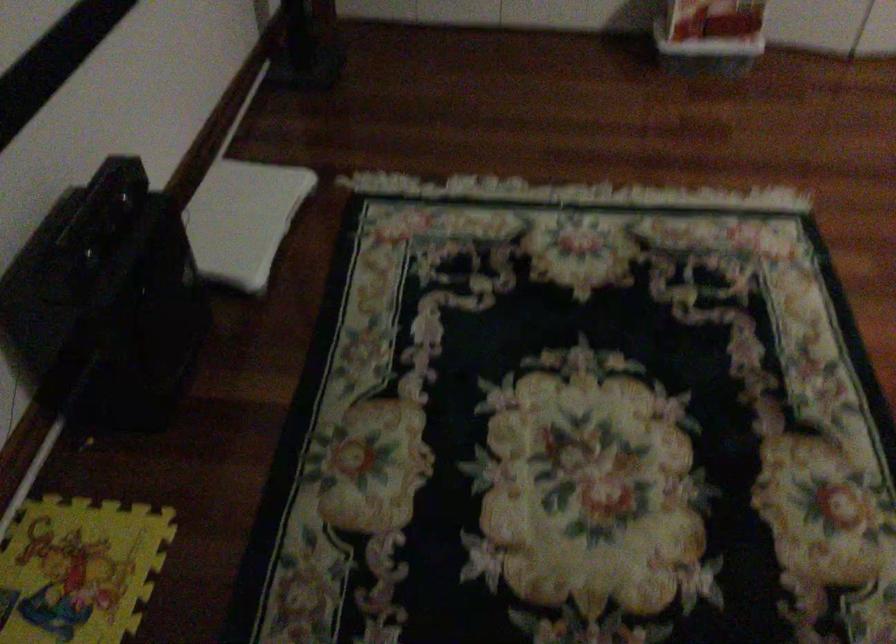
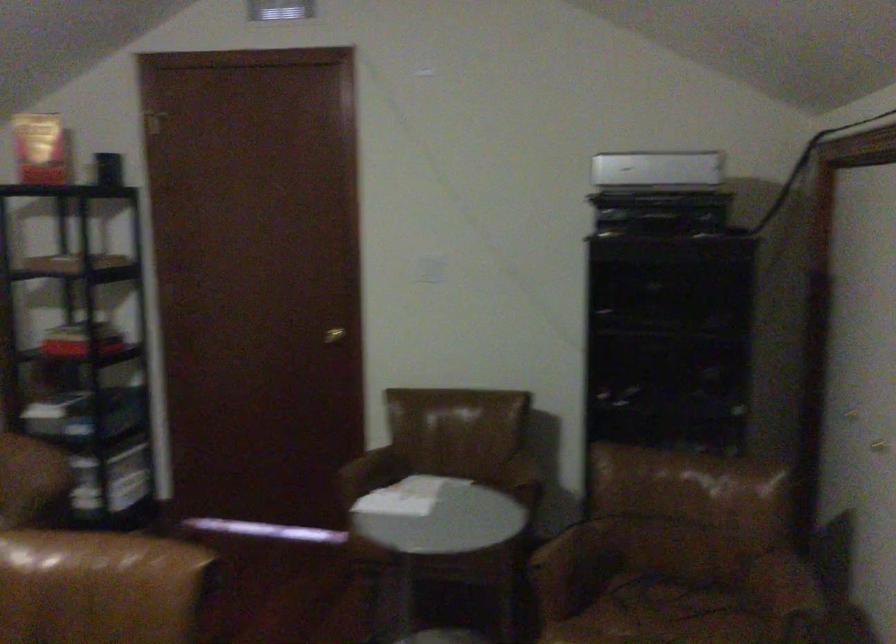
Question: How did the camera likely rotate?

Choices:
 (A) Left
 (B) Right
 (C) Up
 (D) Down

Answer: (B)